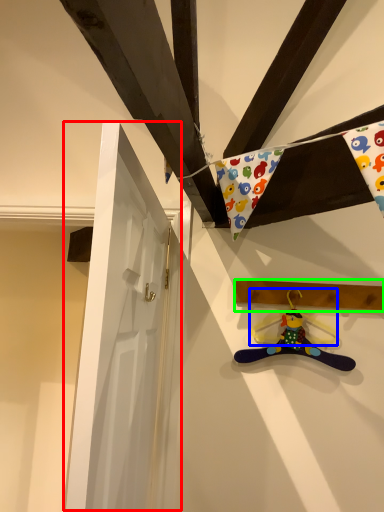
Question: Which is nearer to the door (highlighted by a red box)? hanger (highlighted by a blue box) or plank (highlighted by a green box).

Choices:
 (A) hanger
 (B) plank

Answer: (B)